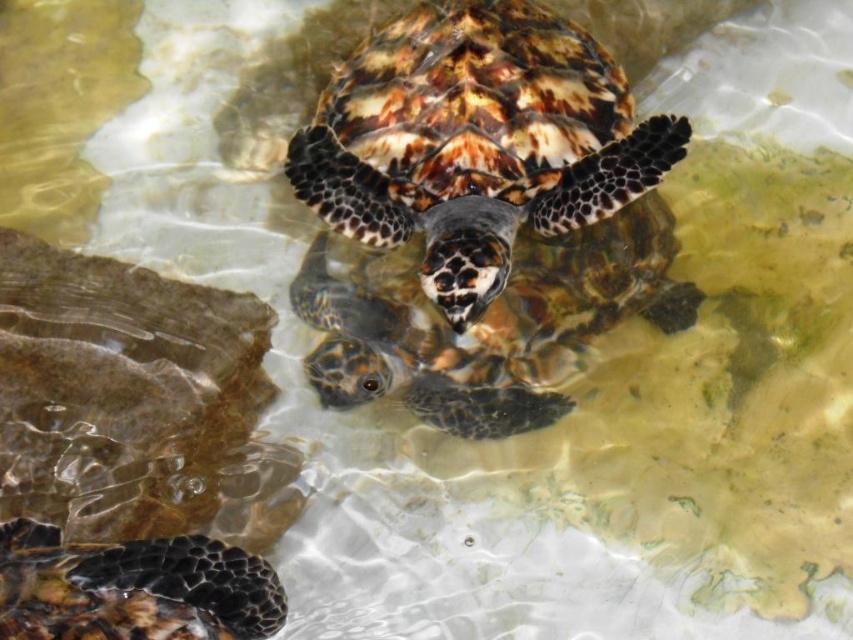
Question: Which point is farther to the camera?

Choices:
 (A) (328, 404)
 (B) (192, 536)
 (C) (373, 132)

Answer: (C)

Question: Which of these objects is positioned closest to the leopard print shell at center?

Choices:
 (A) patterned shell at lower left
 (B) leathery brown tortoise at center

Answer: (B)

Question: Which point is closer to the camera?

Choices:
 (A) leopard print shell at center
 (B) patterned shell at lower left

Answer: (B)

Question: Can you confirm if leopard print shell at center is positioned above leathery brown tortoise at center?

Choices:
 (A) no
 (B) yes

Answer: (B)

Question: Is patterned shell at lower left to the right of leathery brown tortoise at center from the viewer's perspective?

Choices:
 (A) no
 (B) yes

Answer: (A)

Question: Does leopard print shell at center have a smaller size compared to patterned shell at lower left?

Choices:
 (A) no
 (B) yes

Answer: (A)